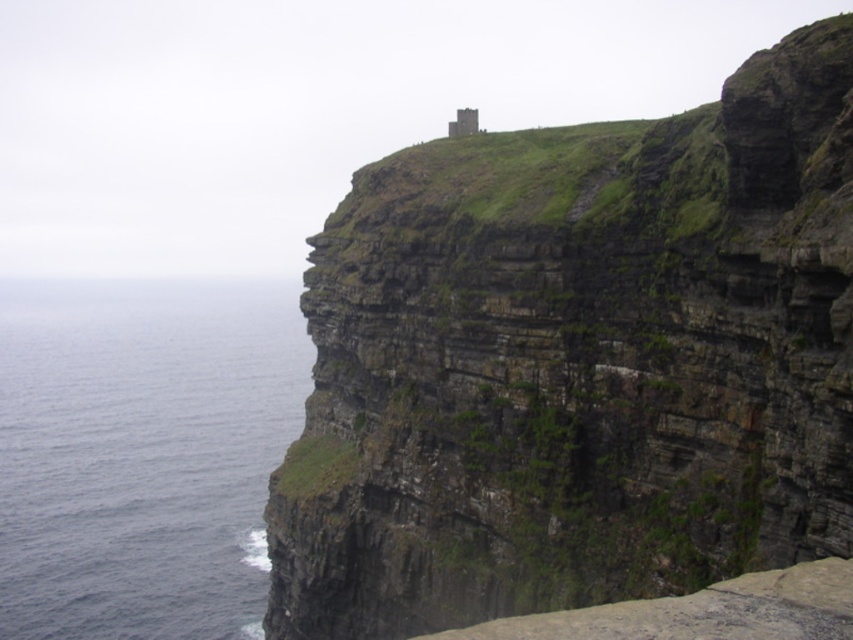
Describe the element at coordinates (578, 362) in the screenshot. I see `green mossy rock at upper center` at that location.

This screenshot has height=640, width=853. Find the location of `green mossy rock at upper center`. green mossy rock at upper center is located at coordinates (578, 362).